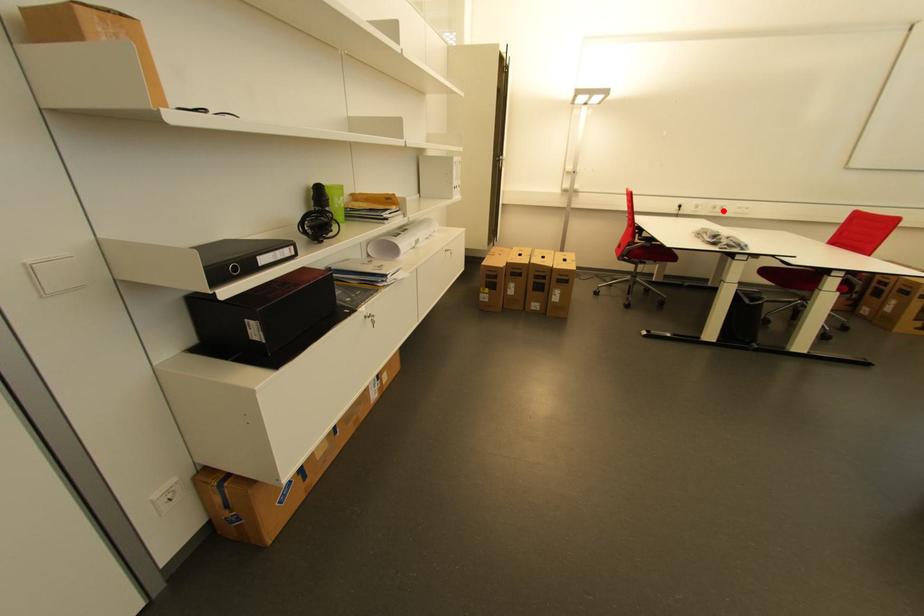
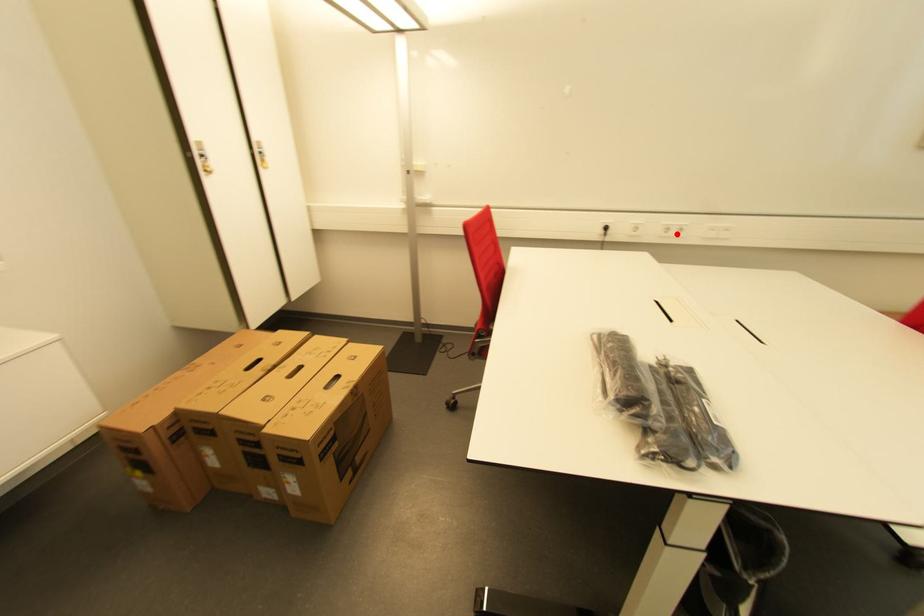
I am providing you with two images of the same scene from different viewpoints. A red point is marked on the first image and another point is marked on the second image. Is the red point in image1 aligned with the point shown in image2?

Yes